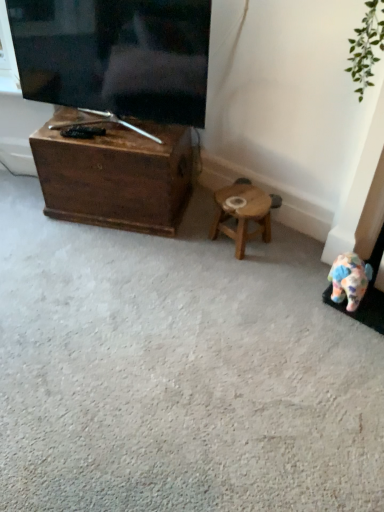
Question: From the image's perspective, is matte black tv at upper left under wooden stool at center?

Choices:
 (A) no
 (B) yes

Answer: (A)

Question: Can you confirm if matte black tv at upper left is smaller than wooden stool at center?

Choices:
 (A) no
 (B) yes

Answer: (A)

Question: Is wooden stool at center at the back of matte black tv at upper left?

Choices:
 (A) yes
 (B) no

Answer: (B)

Question: Is matte black tv at upper left oriented towards wooden stool at center?

Choices:
 (A) yes
 (B) no

Answer: (B)

Question: Is matte black tv at upper left positioned far away from wooden stool at center?

Choices:
 (A) yes
 (B) no

Answer: (B)

Question: Is matte black tv at upper left wider than wooden stool at center?

Choices:
 (A) yes
 (B) no

Answer: (B)

Question: Is wooden chest at left not inside matte black tv at upper left?

Choices:
 (A) yes
 (B) no

Answer: (A)

Question: Does wooden chest at left have a lesser height compared to matte black tv at upper left?

Choices:
 (A) no
 (B) yes

Answer: (B)

Question: Does wooden chest at left have a lesser width compared to matte black tv at upper left?

Choices:
 (A) yes
 (B) no

Answer: (B)

Question: Is wooden chest at left turned away from matte black tv at upper left?

Choices:
 (A) yes
 (B) no

Answer: (B)

Question: Considering the relative sizes of wooden chest at left and matte black tv at upper left in the image provided, is wooden chest at left smaller than matte black tv at upper left?

Choices:
 (A) yes
 (B) no

Answer: (B)

Question: Is wooden chest at left at the right side of matte black tv at upper left?

Choices:
 (A) yes
 (B) no

Answer: (A)

Question: Is matte black tv at upper left to the left of wooden chest at left from the viewer's perspective?

Choices:
 (A) no
 (B) yes

Answer: (B)